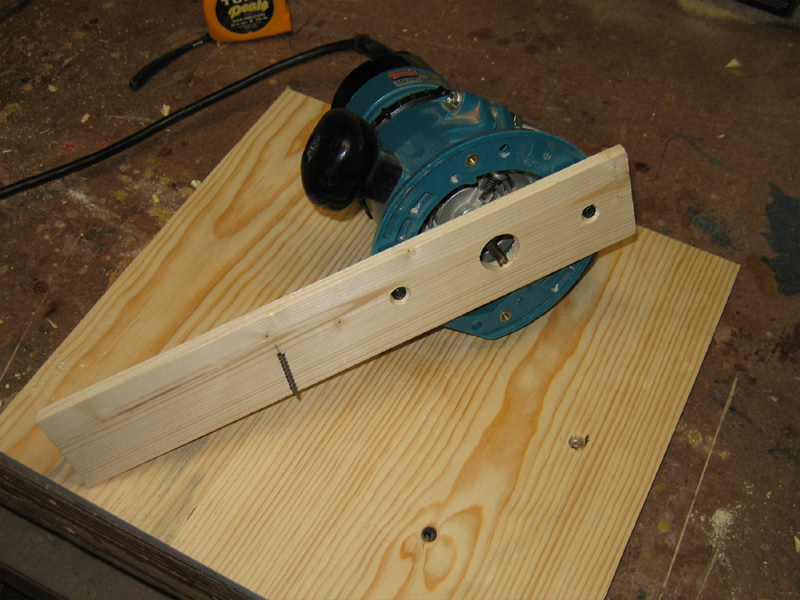
At what (x,y) coordinates should I click in order to perform the action: click on cord. Please return your answer as a coordinate pair (x, y). Looking at the image, I should click on (196, 107).